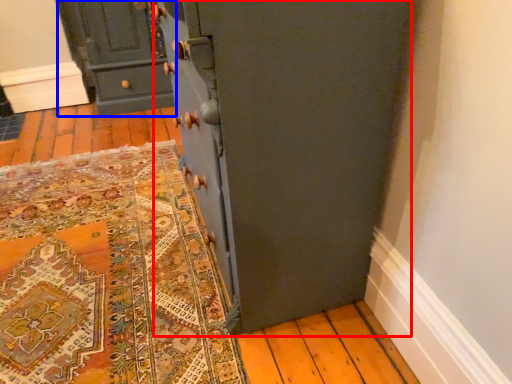
Question: Which object is closer to the camera taking this photo, cupboard (highlighted by a red box) or chest of drawers (highlighted by a blue box)?

Choices:
 (A) cupboard
 (B) chest of drawers

Answer: (A)